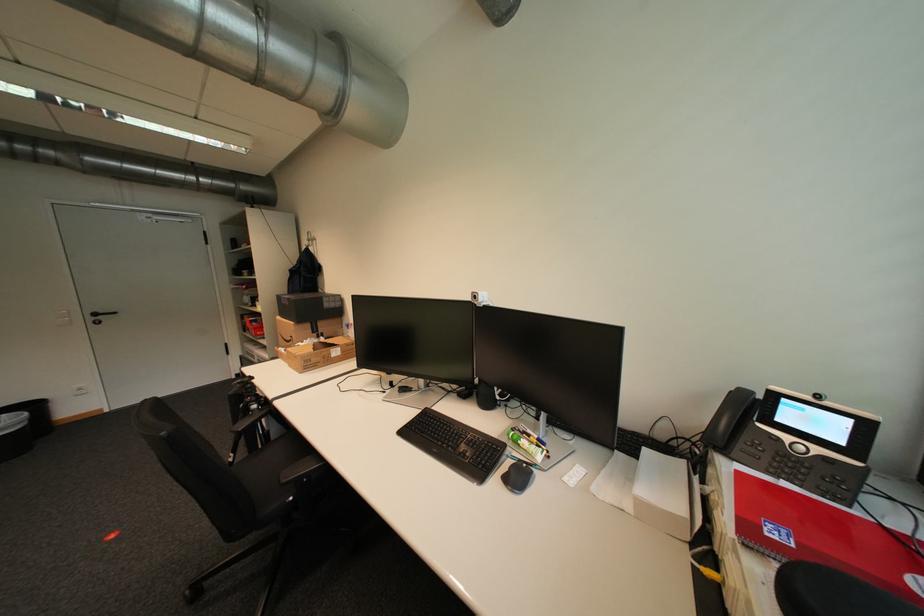
Describe the element at coordinates (100, 315) in the screenshot. The image size is (924, 616). I see `the black door handle` at that location.